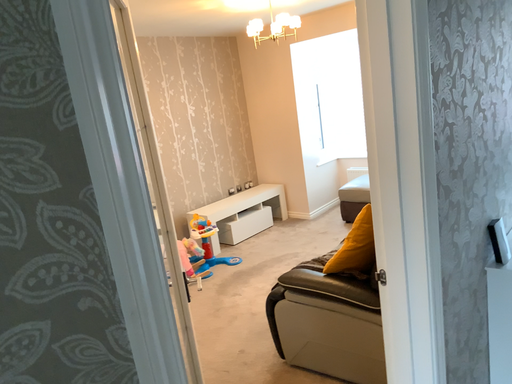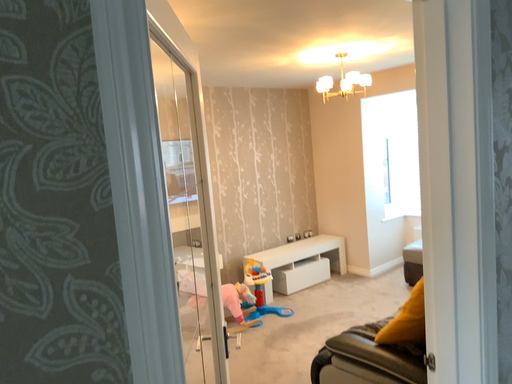
Question: Which way did the camera rotate in the video?

Choices:
 (A) rotated right
 (B) rotated left

Answer: (B)